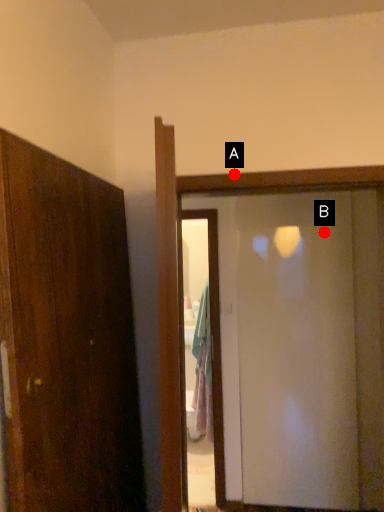
Question: Two points are circled on the image, labeled by A and B beside each circle. Which point is closer to the camera?

Choices:
 (A) A is closer
 (B) B is closer

Answer: (A)